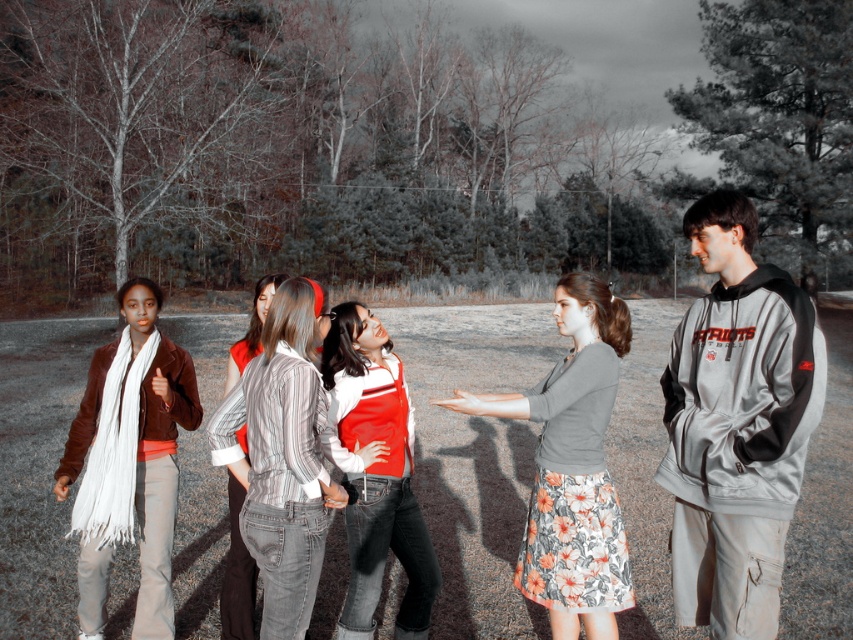
Question: Can you confirm if floral cotton skirt at center is positioned below striped cotton shirt at center?

Choices:
 (A) yes
 (B) no

Answer: (A)

Question: Which point is closer to the camera taking this photo?

Choices:
 (A) (190, 412)
 (B) (602, 632)
 (C) (421, 563)
 (D) (235, 588)

Answer: (B)

Question: Can you confirm if floral cotton skirt at center is positioned above red and white striped sweater at center?

Choices:
 (A) yes
 (B) no

Answer: (B)

Question: Which point is closer to the camera?

Choices:
 (A) (590, 298)
 (B) (790, 282)
 (C) (415, 595)
 (D) (239, 483)

Answer: (B)

Question: Does floral cotton skirt at center have a larger size compared to matte brown jacket at left?

Choices:
 (A) yes
 (B) no

Answer: (A)

Question: Based on their relative distances, which object is nearer to the floral cotton skirt at center?

Choices:
 (A) gray hoodie at right
 (B) red and white striped sweater at center
 (C) striped cotton shirt at center
 (D) matte brown jacket at left

Answer: (A)